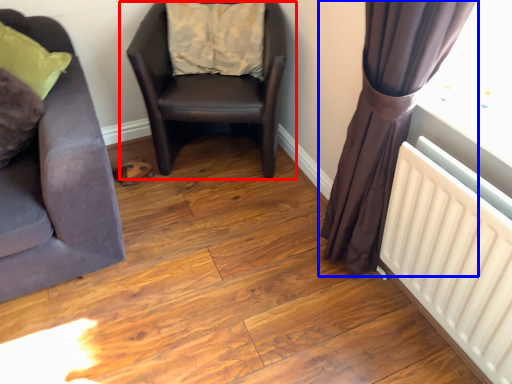
Question: Which object is further to the camera taking this photo, chair (highlighted by a red box) or curtain (highlighted by a blue box)?

Choices:
 (A) chair
 (B) curtain

Answer: (A)